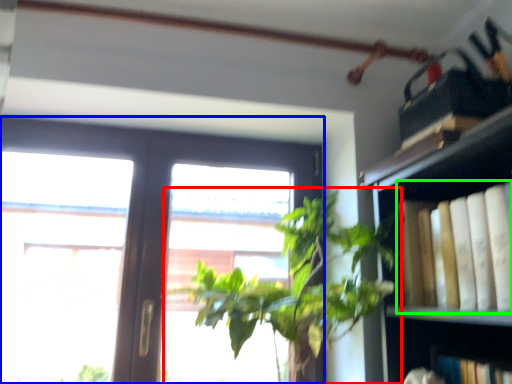
Question: Which is nearer to the houseplant (highlighted by a red box)? window (highlighted by a blue box) or book (highlighted by a green box).

Choices:
 (A) window
 (B) book

Answer: (B)